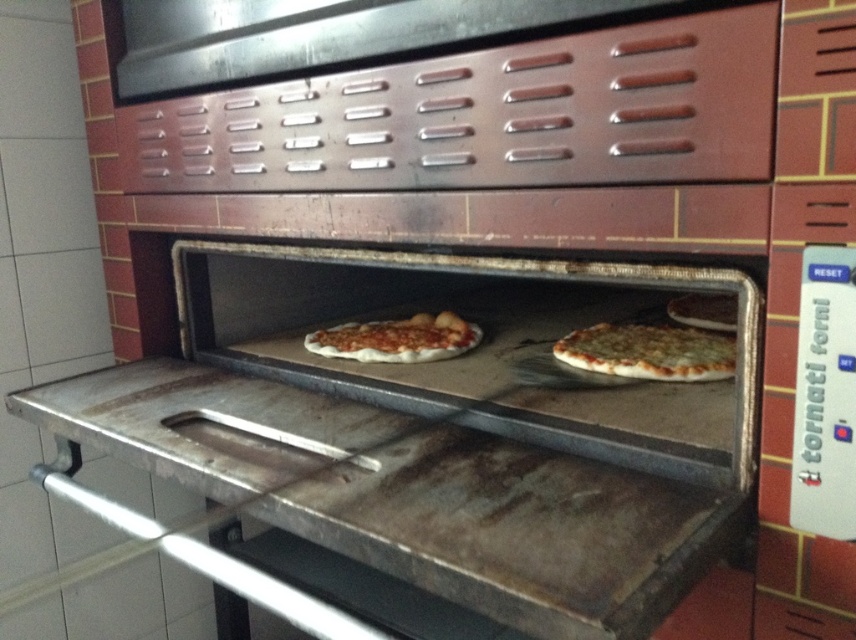
Question: In this image, where is golden brown crusty pizza at center located relative to matte white pizza at center?

Choices:
 (A) right
 (B) left

Answer: (A)

Question: Is golden brown crusty pizza at center closer to the viewer compared to matte white pizza at center?

Choices:
 (A) no
 (B) yes

Answer: (B)

Question: Which object is farther from the camera taking this photo?

Choices:
 (A) golden brown crusty pizza at center
 (B) matte white pizza at center

Answer: (B)

Question: Is golden brown crusty pizza at center wider than matte white pizza at center?

Choices:
 (A) no
 (B) yes

Answer: (A)

Question: Which point appears closest to the camera in this image?

Choices:
 (A) (569, 339)
 (B) (331, 352)

Answer: (A)

Question: Which point is farther to the camera?

Choices:
 (A) golden brown crusty pizza at center
 (B) matte white pizza at center

Answer: (B)